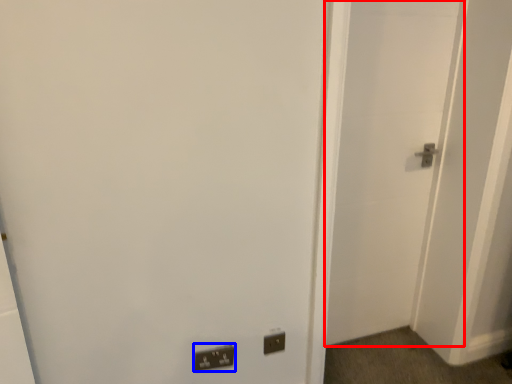
Question: Which object is further to the camera taking this photo, door (highlighted by a red box) or light switch (highlighted by a blue box)?

Choices:
 (A) door
 (B) light switch

Answer: (B)